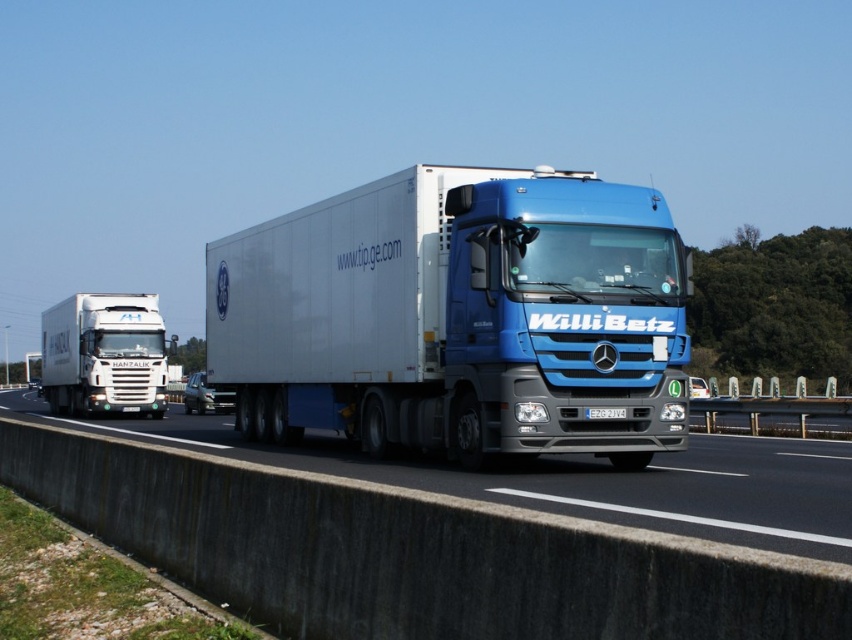
Can you confirm if white glossy truck at left is shorter than white plastic license plate at center?

No, white glossy truck at left is not shorter than white plastic license plate at center.

Who is higher up, white glossy truck at left or white plastic license plate at center?

white glossy truck at left is above.

I want to click on white glossy truck at left, so click(x=104, y=355).

Locate an element on the screen. The image size is (852, 640). white glossy truck at left is located at coordinates (104, 355).

Is blue glossy trailer truck at center closer to camera compared to white plastic license plate at center?

Yes, it is in front of white plastic license plate at center.

Can you confirm if blue glossy trailer truck at center is positioned below white plastic license plate at center?

Incorrect, blue glossy trailer truck at center is not positioned below white plastic license plate at center.

Is point (225, 237) positioned after point (591, 416)?

Yes, point (225, 237) is farther from viewer.

Find the location of a particular element. Image resolution: width=852 pixels, height=640 pixels. blue glossy trailer truck at center is located at coordinates (458, 316).

Between blue glossy trailer truck at center and blue metallic truck at center, which one is positioned lower?

blue metallic truck at center

Is the position of blue glossy trailer truck at center more distant than that of blue metallic truck at center?

Yes.

The width and height of the screenshot is (852, 640). Describe the element at coordinates (458, 316) in the screenshot. I see `blue glossy trailer truck at center` at that location.

This screenshot has width=852, height=640. In order to click on blue glossy trailer truck at center in this screenshot , I will do `click(458, 316)`.